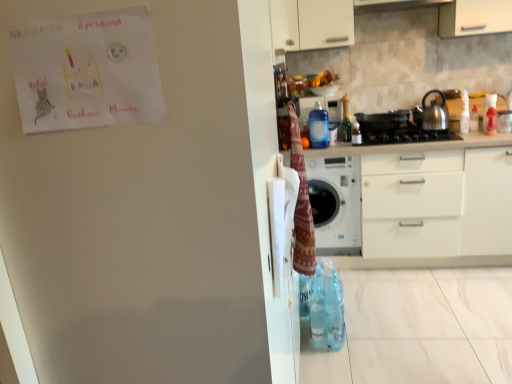
Image resolution: width=512 pixels, height=384 pixels. I want to click on free point below satin silver kettle at right (from a real-world perspective), so click(430, 126).